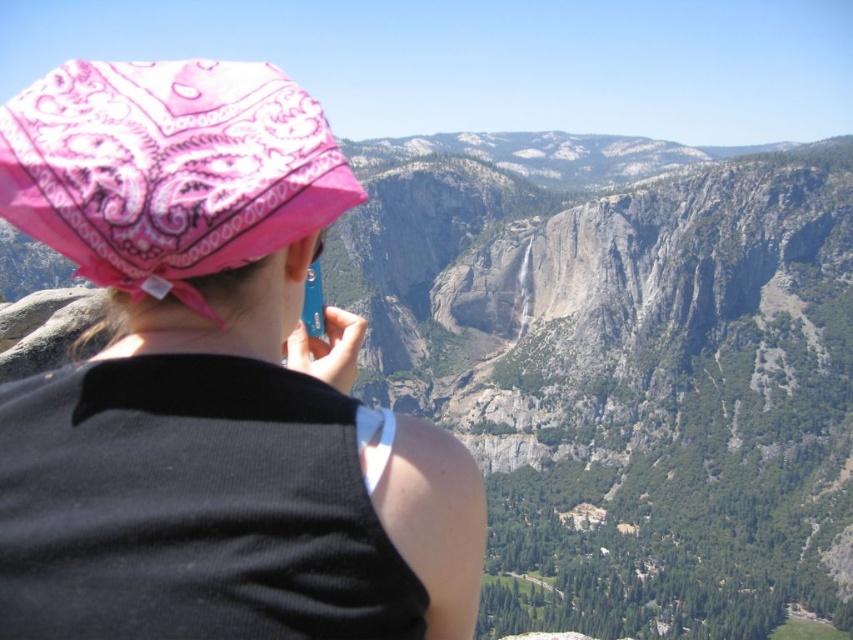
You are a photographer trying to capture the pink bandana at center and the pink paisley bandana at upper left in a single frame. Which bandana will appear larger in the photo?

The pink bandana at center will appear larger in the photo because it has a greater height compared to the pink paisley bandana at upper left.

You are a photographer trying to capture the pink bandana at center and the pink paisley bandana at upper left in a single frame. Which bandana will appear wider in the photo?

The pink bandana at center will appear wider in the photo because its width surpasses that of the pink paisley bandana at upper left.